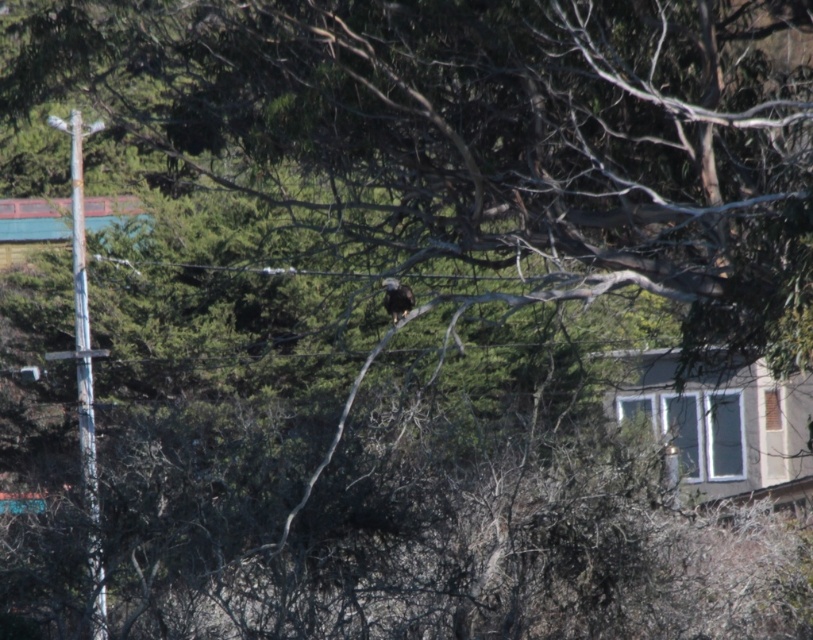
You are a birdwatcher trying to spot the dark brown feathers at center from the rusty metal pole at left. Which object is bigger in the image?

The rusty metal pole at left is larger in size than dark brown feathers at center.

You are a photographer standing at the camera position. You want to take a photo of the bird perched on the branch while including the rusty metal pole at left in the frame. Given that the pole is 68.73 feet away from you, can you estimate whether the bird is closer to you than the pole?

The bird is perched on a branch in the middle ground, while the rusty metal pole at left is 68.73 feet away from the camera. Since the bird is in the middle ground and the pole is at 68.73 feet, the bird is closer to the photographer than the pole.